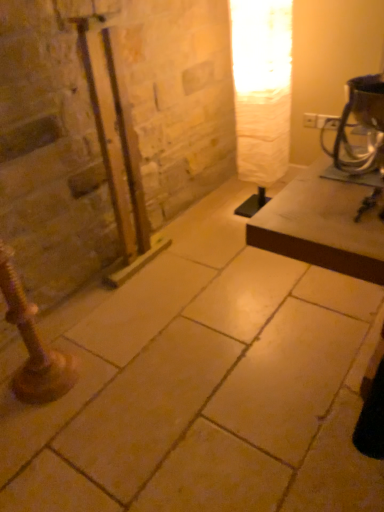
I want to click on free space above matte stone concrete at center (from a real-world perspective), so click(x=216, y=319).